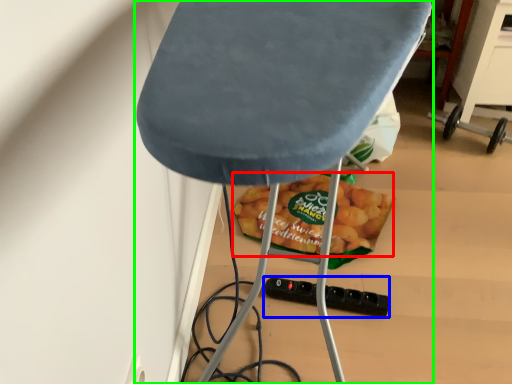
Question: Estimate the real-world distances between objects in this image. Which object is closer to snack (highlighted by a red box), socket (highlighted by a blue box) or furniture (highlighted by a green box)?

Choices:
 (A) socket
 (B) furniture

Answer: (A)